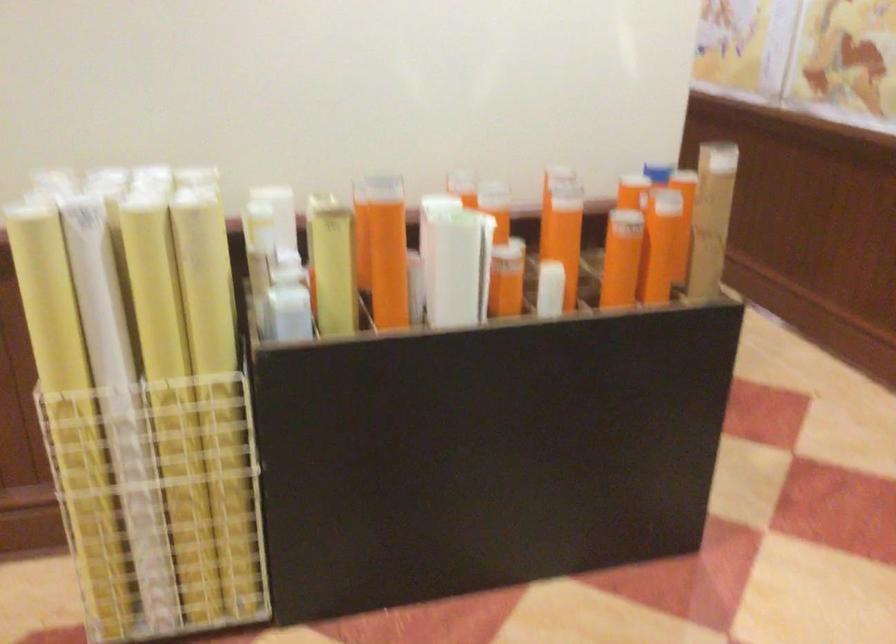
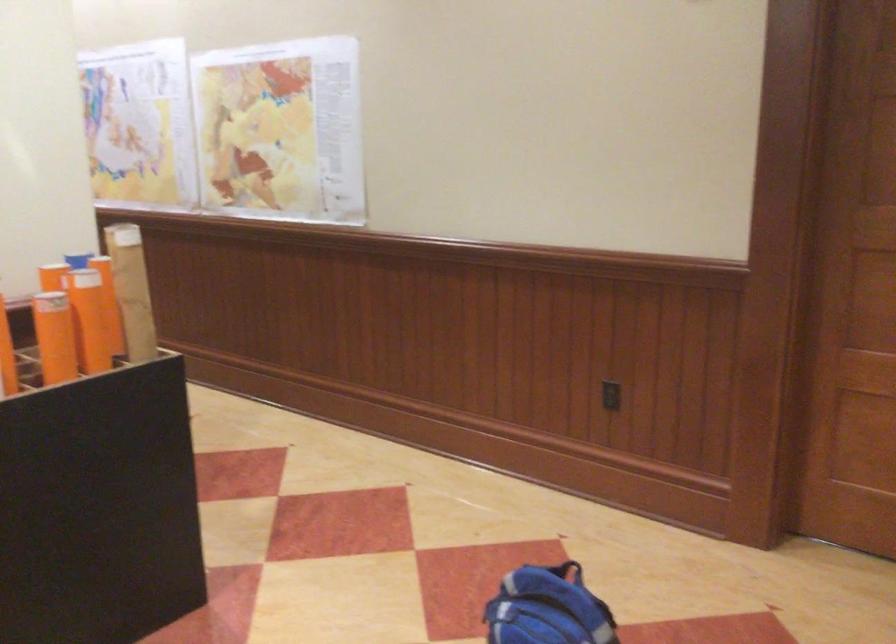
In the second image, find the point that corresponds to the point at 556,272 in the first image.

(6, 355)